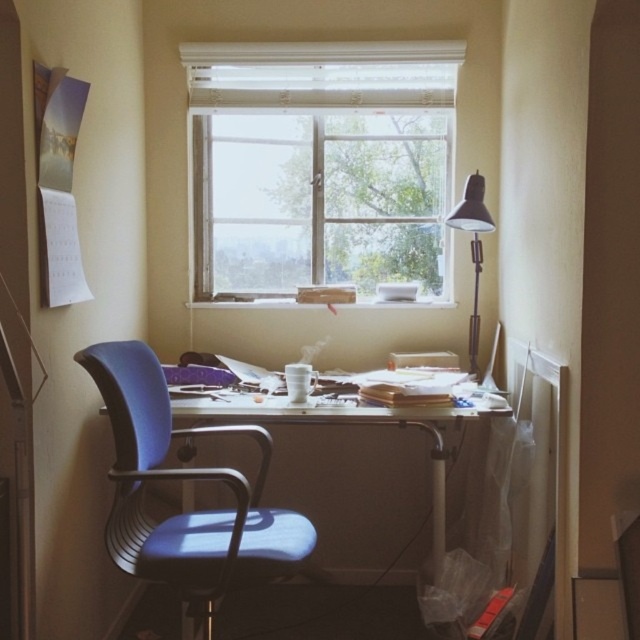
Does blue fabric computer desk at center have a greater width compared to metallic gray floor lamp at right?

Indeed, blue fabric computer desk at center has a greater width compared to metallic gray floor lamp at right.

Can you confirm if blue fabric computer desk at center is thinner than metallic gray floor lamp at right?

No.

The width and height of the screenshot is (640, 640). In order to click on blue fabric computer desk at center in this screenshot , I will do `click(356, 424)`.

You are a GUI agent. You are given a task and a screenshot of the screen. Output one action in this format:
    pyautogui.click(x=<x>, y=<y>)
    Task: Click on the blue fabric computer desk at center
    Image resolution: width=640 pixels, height=640 pixels.
    Given the screenshot: What is the action you would take?
    pyautogui.click(x=356, y=424)

Is blue fabric swivel chair at left further to camera compared to metallic gray floor lamp at right?

No, blue fabric swivel chair at left is in front of metallic gray floor lamp at right.

Is point (224, 588) positioned before point (480, 180)?

Yes, point (224, 588) is in front of point (480, 180).

Is point (141, 348) positioned after point (481, 173)?

No, it is in front of (481, 173).

This screenshot has height=640, width=640. Find the location of `blue fabric swivel chair at left`. blue fabric swivel chair at left is located at coordinates (184, 480).

Is white textured window at upper center positioned before metallic gray floor lamp at right?

No, it is not.

Can you confirm if white textured window at upper center is positioned below metallic gray floor lamp at right?

Incorrect, white textured window at upper center is not positioned below metallic gray floor lamp at right.

Describe the element at coordinates (321, 166) in the screenshot. The height and width of the screenshot is (640, 640). I see `white textured window at upper center` at that location.

In order to click on white textured window at upper center in this screenshot , I will do `click(321, 166)`.